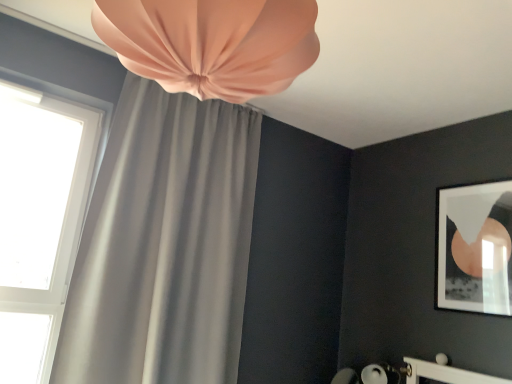
Question: Would you say matte gray curtain at upper left, the 2th curtain in the front-to-back sequence, contains matte black frame at upper right?

Choices:
 (A) yes
 (B) no

Answer: (B)

Question: Considering the relative sizes of matte gray curtain at upper left, the 1th curtain in the back-to-front sequence, and matte black frame at upper right in the image provided, is matte gray curtain at upper left, the 1th curtain in the back-to-front sequence, shorter than matte black frame at upper right?

Choices:
 (A) yes
 (B) no

Answer: (B)

Question: Does matte gray curtain at upper left, the 2th curtain in the front-to-back sequence, have a larger size compared to matte black frame at upper right?

Choices:
 (A) yes
 (B) no

Answer: (A)

Question: Is matte gray curtain at upper left, the 1th curtain in the back-to-front sequence, closer to the viewer compared to matte black frame at upper right?

Choices:
 (A) no
 (B) yes

Answer: (B)

Question: Is matte gray curtain at upper left, the 2th curtain in the front-to-back sequence, facing away from matte black frame at upper right?

Choices:
 (A) yes
 (B) no

Answer: (B)

Question: Is matte gray curtain at upper left, the 1th curtain in the back-to-front sequence, facing towards matte black frame at upper right?

Choices:
 (A) yes
 (B) no

Answer: (B)

Question: From the image's perspective, would you say matte gray curtain at upper left, the 1th curtain in the back-to-front sequence, is shown under matte gray curtain at upper left, the 2th curtain when ordered from back to front?

Choices:
 (A) no
 (B) yes

Answer: (B)

Question: Is matte gray curtain at upper left, the 1th curtain in the back-to-front sequence, bigger than matte gray curtain at upper left, the 2th curtain when ordered from back to front?

Choices:
 (A) yes
 (B) no

Answer: (A)

Question: Is matte gray curtain at upper left, the 2th curtain in the front-to-back sequence, at the right side of matte gray curtain at upper left, the first curtain when ordered from front to back?

Choices:
 (A) no
 (B) yes

Answer: (A)

Question: Is matte gray curtain at upper left, the 1th curtain in the back-to-front sequence, far away from matte gray curtain at upper left, the 2th curtain when ordered from back to front?

Choices:
 (A) yes
 (B) no

Answer: (A)

Question: From a real-world perspective, is matte gray curtain at upper left, the 1th curtain in the back-to-front sequence, on matte gray curtain at upper left, the 2th curtain when ordered from back to front?

Choices:
 (A) yes
 (B) no

Answer: (B)

Question: Does matte gray curtain at upper left, the 1th curtain in the back-to-front sequence, contain matte gray curtain at upper left, the first curtain when ordered from front to back?

Choices:
 (A) no
 (B) yes

Answer: (A)

Question: Considering the relative sizes of matte black frame at upper right and matte gray curtain at upper left, the 2th curtain when ordered from back to front, in the image provided, is matte black frame at upper right thinner than matte gray curtain at upper left, the 2th curtain when ordered from back to front,?

Choices:
 (A) no
 (B) yes

Answer: (B)